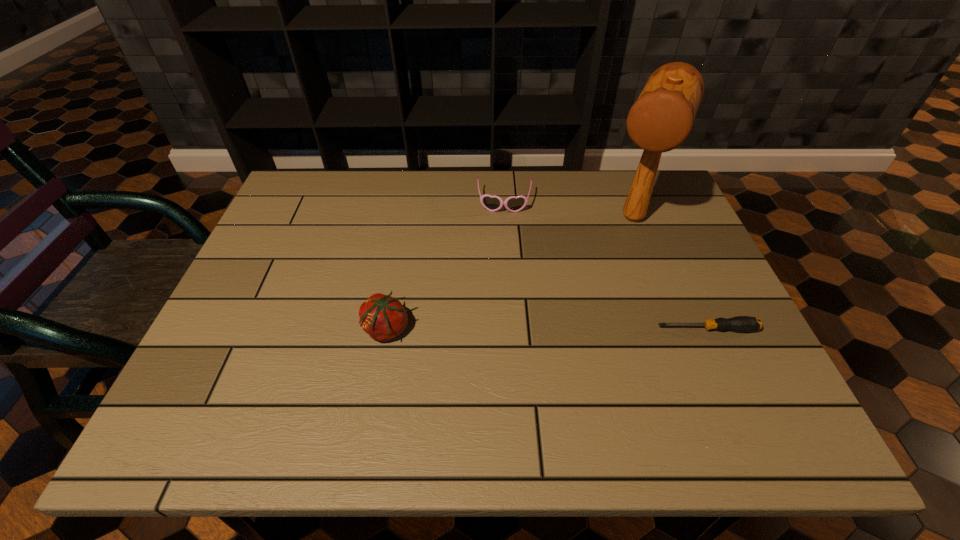
This screenshot has height=540, width=960. In the image, there is a desktop. Identify the location of vacant space at the far edge. (409, 212).

The width and height of the screenshot is (960, 540). Find the location of `free space at the near edge of the desktop`. free space at the near edge of the desktop is located at coordinates coord(635,366).

This screenshot has height=540, width=960. In the image, there is a desktop. In order to click on vacant space at the left edge in this screenshot , I will do `click(276, 269)`.

Identify the location of vacant space at the right edge of the desktop. The width and height of the screenshot is (960, 540). (721, 292).

Where is `vacant space at the far left corner of the desktop`? vacant space at the far left corner of the desktop is located at coordinates (295, 199).

The image size is (960, 540). In order to click on vacant space that is in between the screwdriver and the mallet in this screenshot , I will do `click(670, 274)`.

Where is `free space between the second object from left to right and the screwdriver`? The width and height of the screenshot is (960, 540). free space between the second object from left to right and the screwdriver is located at coordinates pyautogui.click(x=606, y=266).

The image size is (960, 540). I want to click on unoccupied area between the third shortest object and the screwdriver, so click(x=546, y=329).

I want to click on free space that is in between the mallet and the second object from left to right, so click(568, 211).

Find the location of a particular element. This screenshot has height=540, width=960. free point between the leftmost object and the screwdriver is located at coordinates (546, 329).